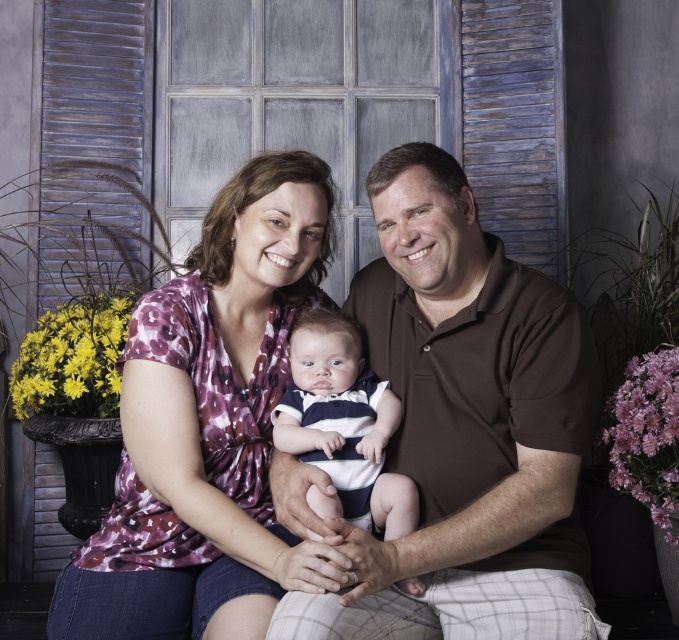
Can you confirm if brown smooth shirt at center is shorter than striped cotton shirt at center?

No.

Does brown smooth shirt at center appear on the right side of striped cotton shirt at center?

Yes, brown smooth shirt at center is to the right of striped cotton shirt at center.

The height and width of the screenshot is (640, 679). Find the location of `brown smooth shirt at center`. brown smooth shirt at center is located at coordinates (466, 428).

Based on the photo, does purple tie-dye shirt at center have a larger size compared to striped cotton shirt at center?

Correct, purple tie-dye shirt at center is larger in size than striped cotton shirt at center.

Who is more distant from viewer, [333,234] or [385,392]?

The point [333,234] is behind.

Is point (201, 570) less distant than point (331, 454)?

No, it is behind (331, 454).

You are a GUI agent. You are given a task and a screenshot of the screen. Output one action in this format:
    pyautogui.click(x=<x>, y=<y>)
    Task: Click on the purple tie-dye shirt at center
    
    Given the screenshot: What is the action you would take?
    pyautogui.click(x=208, y=426)

Can you confirm if brown smooth shirt at center is shorter than purple tie-dye shirt at center?

Yes.

Is point (394, 602) positioned in front of point (162, 627)?

Yes, point (394, 602) is in front of point (162, 627).

Which is behind, point (458, 593) or point (128, 560)?

Positioned behind is point (128, 560).

Locate an element on the screen. The height and width of the screenshot is (640, 679). brown smooth shirt at center is located at coordinates pyautogui.click(x=466, y=428).